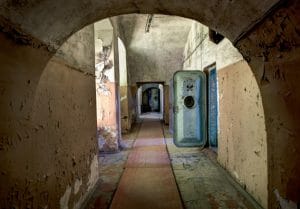
At what (x,y) coordinates should I click in order to perform the action: click on ceiling. Please return your answer as a coordinate pair (x, y). This screenshot has width=300, height=209. Looking at the image, I should click on (160, 25), (76, 13).